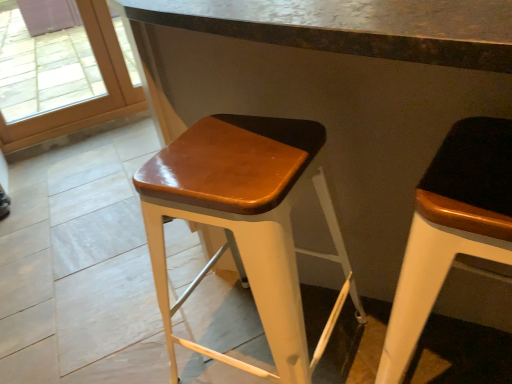
In order to click on free spot above glossy wood stool at center, which ranks as the 1th stool in left-to-right order (from a real-world perspective) in this screenshot , I will do `click(232, 150)`.